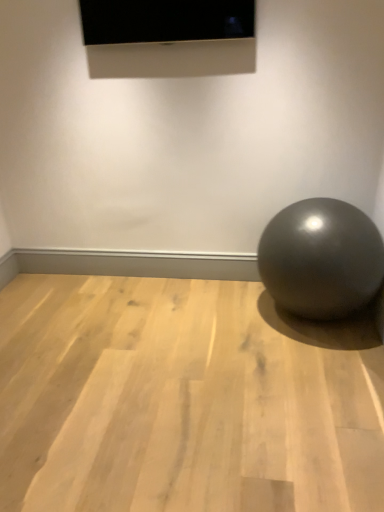
Question: From a real-world perspective, is light wood floor at center above or below glossy metallic ball at lower right?

Choices:
 (A) above
 (B) below

Answer: (B)

Question: From the image's perspective, relative to glossy metallic ball at lower right, is light wood floor at center above or below?

Choices:
 (A) below
 (B) above

Answer: (A)

Question: Which of these objects is positioned closest to the matte black screen at upper center?

Choices:
 (A) light wood floor at center
 (B) glossy metallic ball at lower right

Answer: (B)

Question: Which object is the closest to the light wood floor at center?

Choices:
 (A) glossy metallic ball at lower right
 (B) matte black screen at upper center

Answer: (A)